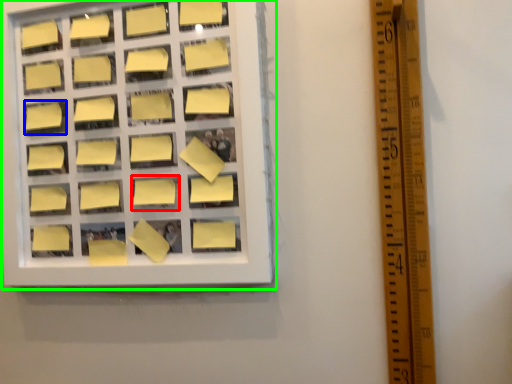
Question: Considering the real-world distances, which object is farthest from square (highlighted by a red box)? square (highlighted by a blue box) or window frame (highlighted by a green box)?

Choices:
 (A) square
 (B) window frame

Answer: (A)